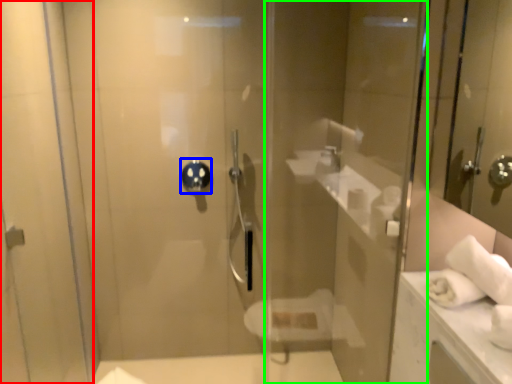
Question: Which is nearer to the screen door (highlighted by a red box)? shower (highlighted by a blue box) or glass door (highlighted by a green box).

Choices:
 (A) shower
 (B) glass door

Answer: (A)